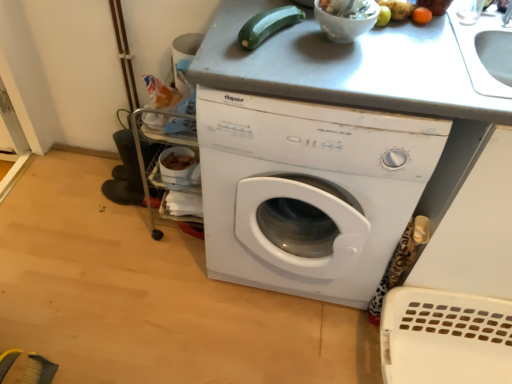
Where is `empty space that is to the right of orange matte fruit at upper right, the second vegetable from the left`? The height and width of the screenshot is (384, 512). empty space that is to the right of orange matte fruit at upper right, the second vegetable from the left is located at coordinates (448, 21).